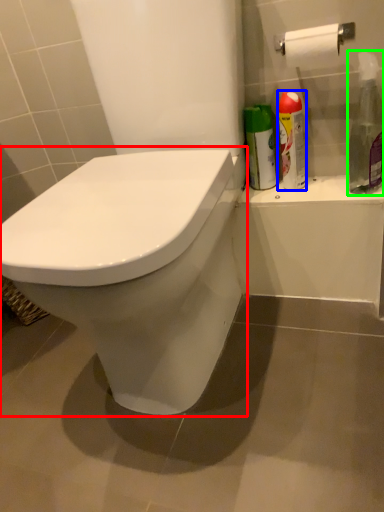
Question: Which object is positioned closest to toilet (highlighted by a red box)? Select from cleaning product (highlighted by a blue box) and cleaning product (highlighted by a green box).

Choices:
 (A) cleaning product
 (B) cleaning product

Answer: (A)